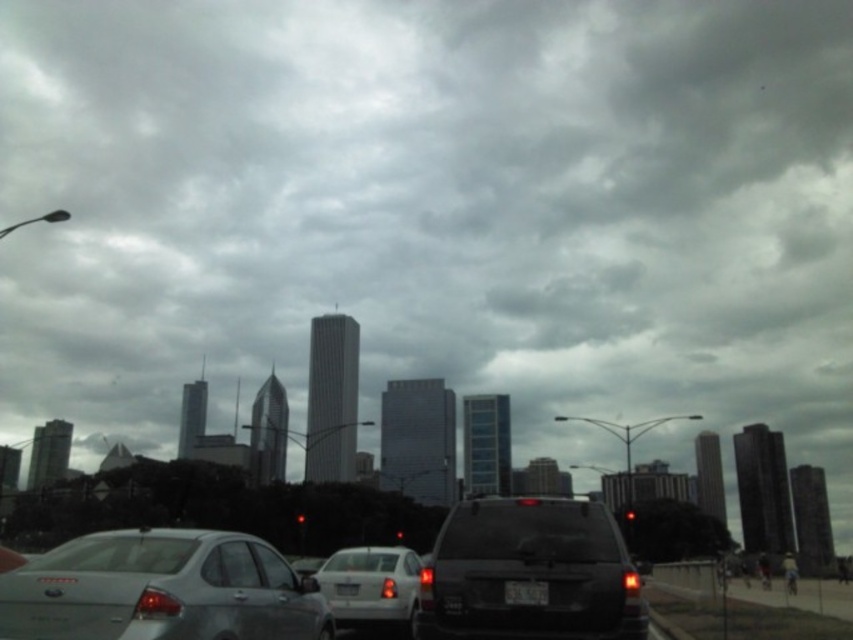
Who is lower down, white matte sedan at center or black matte tree at center?

Positioned lower is black matte tree at center.

Is point (402, 624) more distant than point (670, 506)?

No.

Which is behind, point (346, 557) or point (657, 508)?

The point (657, 508) is behind.

At what (x,y) coordinates should I click in order to perform the action: click on white matte sedan at center. Please return your answer as a coordinate pair (x, y). This screenshot has height=640, width=853. Looking at the image, I should click on (372, 588).

Is the position of satin silver sedan at lower left less distant than that of black matte license plate at center?

That is True.

Can you confirm if satin silver sedan at lower left is thinner than black matte license plate at center?

No.

Is point (189, 566) closer to camera compared to point (508, 584)?

Yes.

Locate an element on the screen. This screenshot has width=853, height=640. satin silver sedan at lower left is located at coordinates (161, 589).

Is point (587, 579) less distant than point (347, 595)?

Yes, point (587, 579) is in front of point (347, 595).

Is matte black van at center closer to camera compared to white plastic license plate at center?

Yes, matte black van at center is closer to the viewer.

Which is behind, point (567, 632) or point (335, 593)?

Point (335, 593)

I want to click on matte black van at center, so click(x=529, y=572).